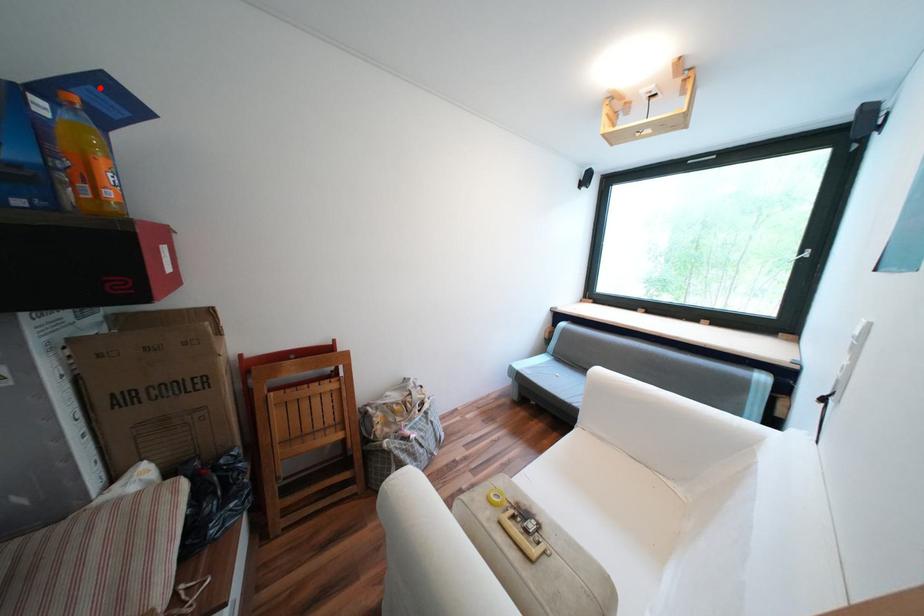
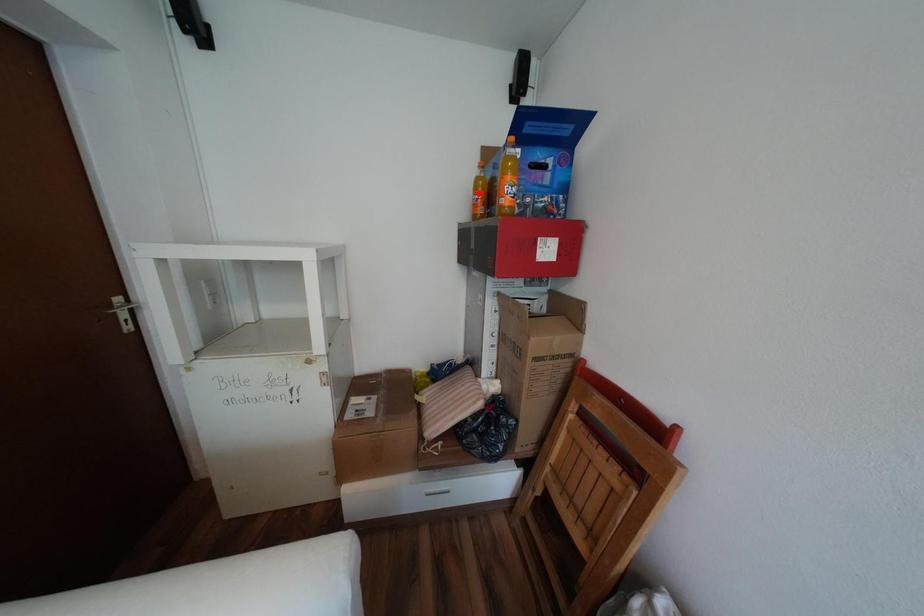
I am providing you with two images of the same scene from different viewpoints. A red point is marked on the first image and another point is marked on the second image. Is the marked point in image1 the same physical position as the marked point in image2?

No